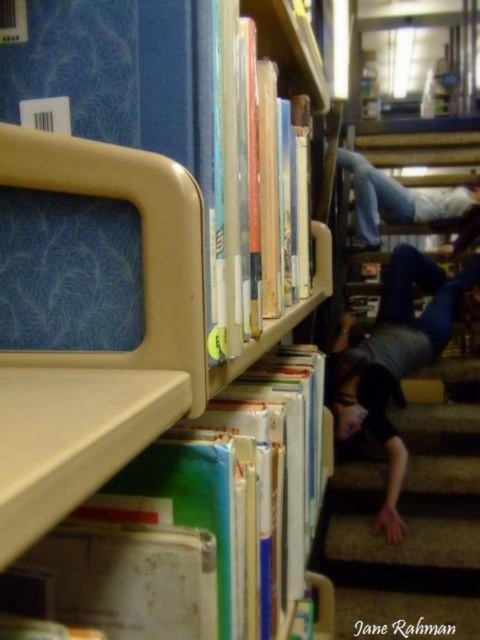
Question: Does hardcover book at upper center have a smaller size compared to dark gray shirt at lower right?

Choices:
 (A) no
 (B) yes

Answer: (B)

Question: Can you confirm if matte plastic bookcase at center is positioned below carpeted stair at lower right?

Choices:
 (A) no
 (B) yes

Answer: (A)

Question: Considering the real-world distances, which object is farthest from the blue jeans at upper right?

Choices:
 (A) green matte book at center
 (B) dark gray shirt at lower right
 (C) carpeted stair at lower right

Answer: (A)

Question: Estimate the real-world distances between objects in this image. Which object is farther from the blue jeans at upper right?

Choices:
 (A) matte plastic bookcase at center
 (B) dark gray shirt at lower right
 (C) green matte book at center

Answer: (A)

Question: Does matte plastic bookcase at center appear over blue jeans at upper right?

Choices:
 (A) no
 (B) yes

Answer: (A)

Question: Which point is closer to the camera taking this photo?

Choices:
 (A) (257, 259)
 (B) (467, 545)
 (C) (6, 320)
 (D) (389, 308)

Answer: (C)